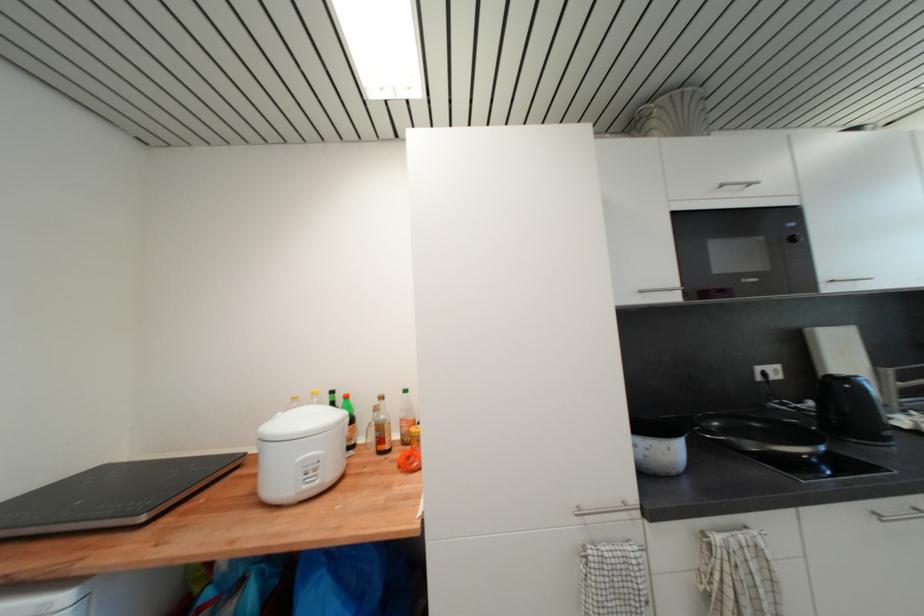
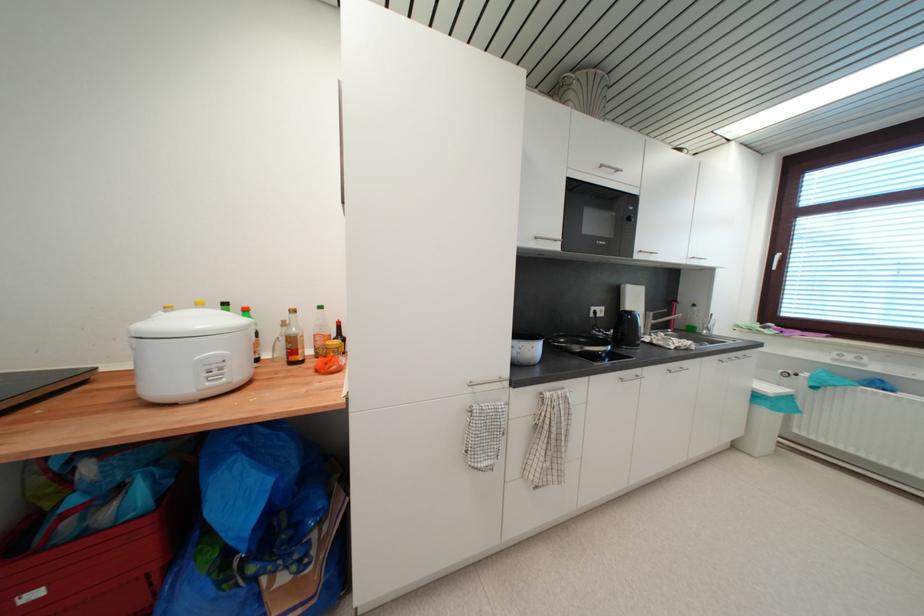
In the second image, find the point that corresponds to (829,278) in the first image.

(642, 251)